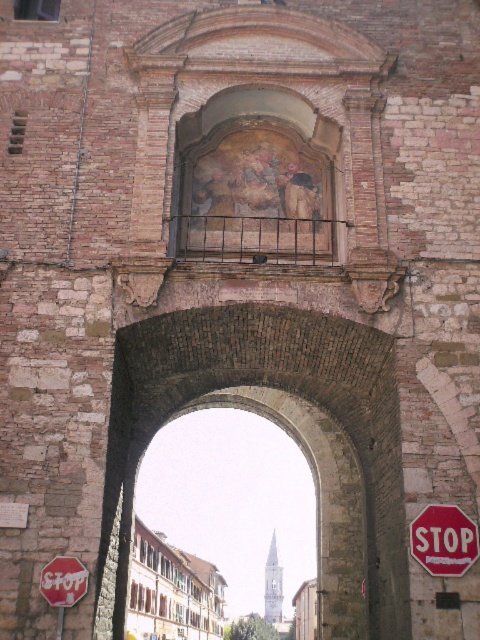
Is stone archway at center further to the viewer compared to red matte stop sign at lower left?

Yes, it is behind red matte stop sign at lower left.

Does stone archway at center have a smaller size compared to red matte stop sign at lower left?

No, stone archway at center is not smaller than red matte stop sign at lower left.

What are the coordinates of `stone archway at center` in the screenshot? It's located at (244, 403).

Can you confirm if rusty metal balcony at upper center is shorter than red matte stop sign at center?

In fact, rusty metal balcony at upper center may be taller than red matte stop sign at center.

Is rusty metal balcony at upper center positioned at the back of red matte stop sign at center?

That is True.

You are a GUI agent. You are given a task and a screenshot of the screen. Output one action in this format:
    pyautogui.click(x=<x>, y=<y>)
    Task: Click on the rusty metal balcony at upper center
    This screenshot has height=640, width=480.
    Given the screenshot: What is the action you would take?
    point(257,237)

Can you confirm if stone archway at center is wider than red matte stop sign at center?

Correct, the width of stone archway at center exceeds that of red matte stop sign at center.

Between point (383, 508) and point (458, 524), which one is positioned in front?

Point (458, 524) is in front.

The height and width of the screenshot is (640, 480). In order to click on stone archway at center in this screenshot , I will do `click(244, 403)`.